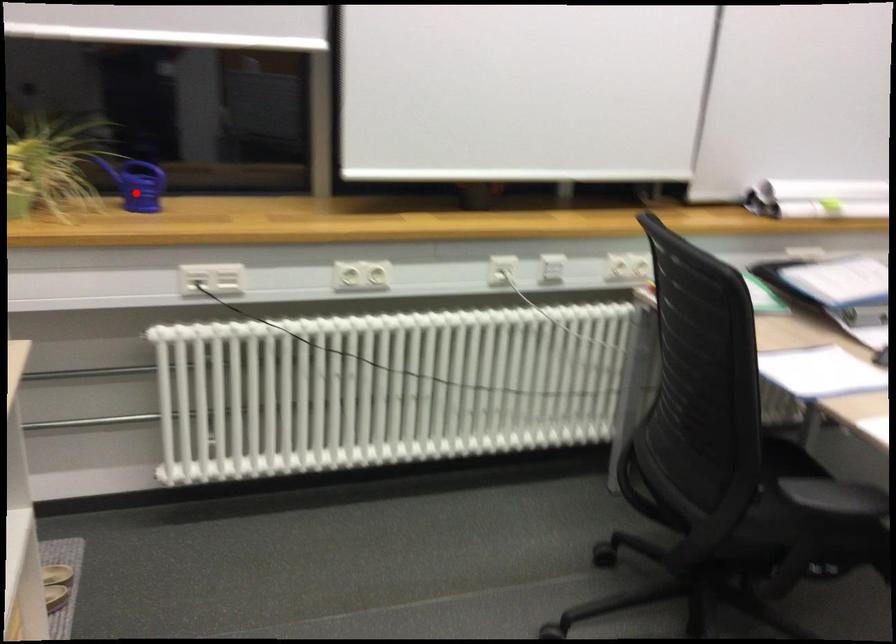
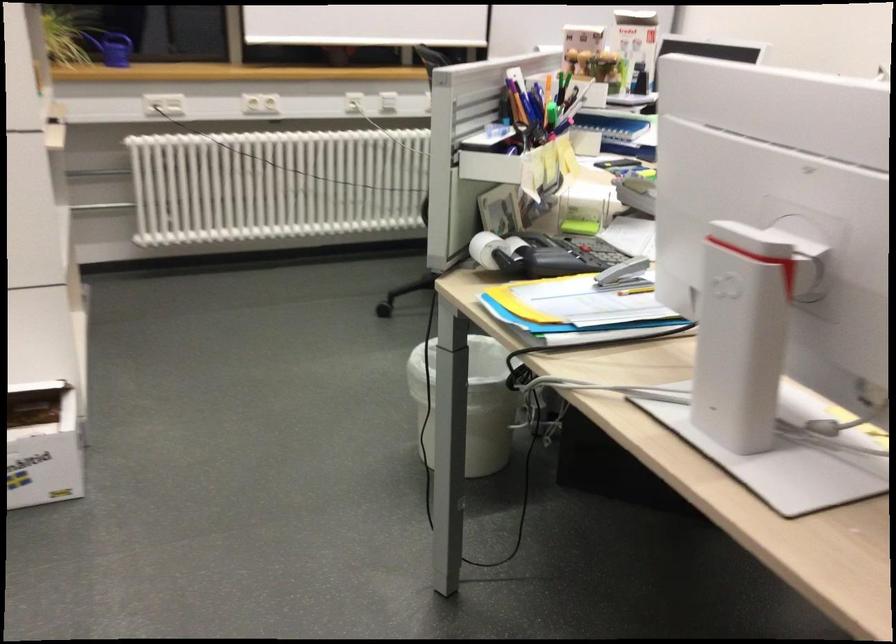
Where in the second image is the point corresponding to the highlighted location from the first image?

(112, 48)